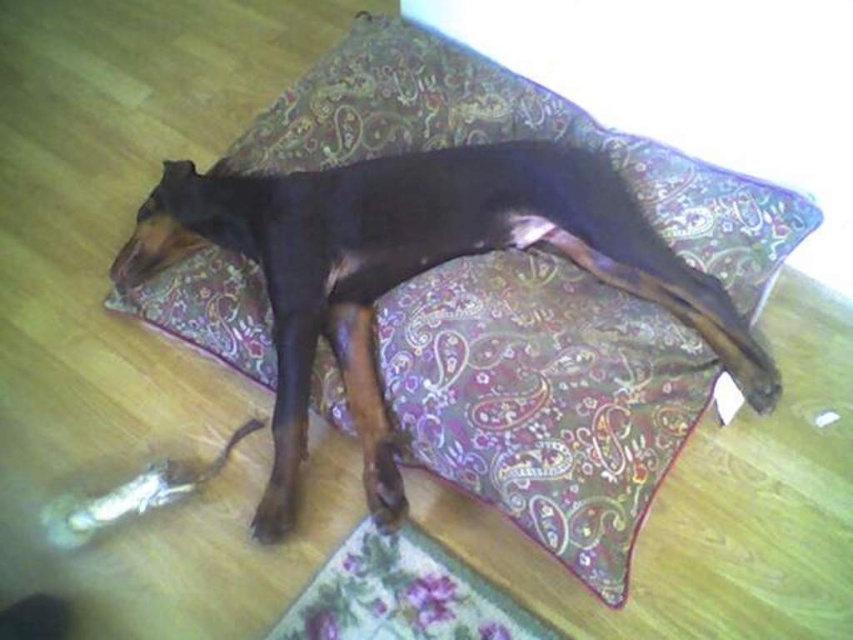
Is point (395, 262) positioned before point (463, 602)?

No, it is behind (463, 602).

Does black glossy dog at center appear on the right side of floral fabric mat at lower center?

Yes, black glossy dog at center is to the right of floral fabric mat at lower center.

Does point (404, 188) come in front of point (537, 636)?

No.

At what (x,y) coordinates should I click in order to perform the action: click on black glossy dog at center. Please return your answer as a coordinate pair (x, y). Image resolution: width=853 pixels, height=640 pixels. Looking at the image, I should click on (413, 268).